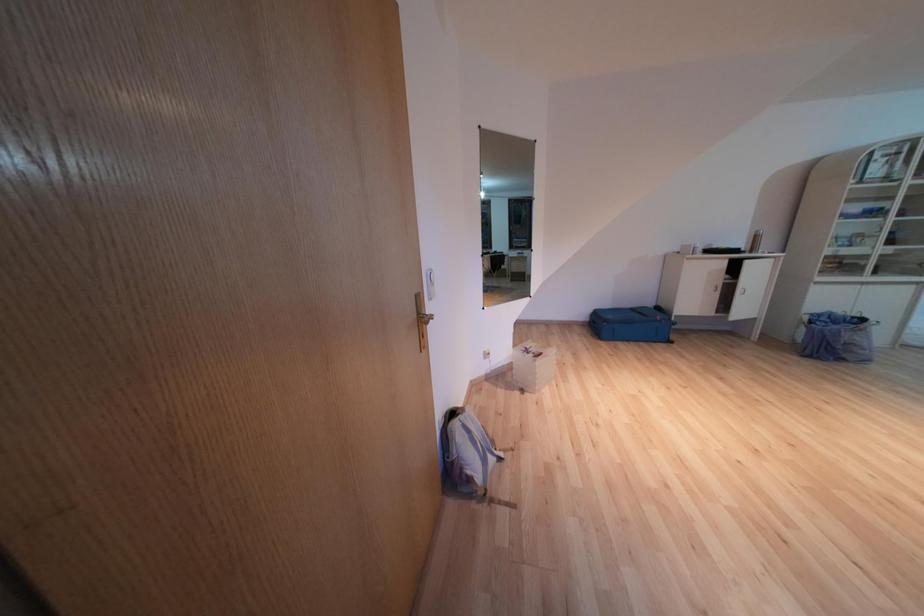
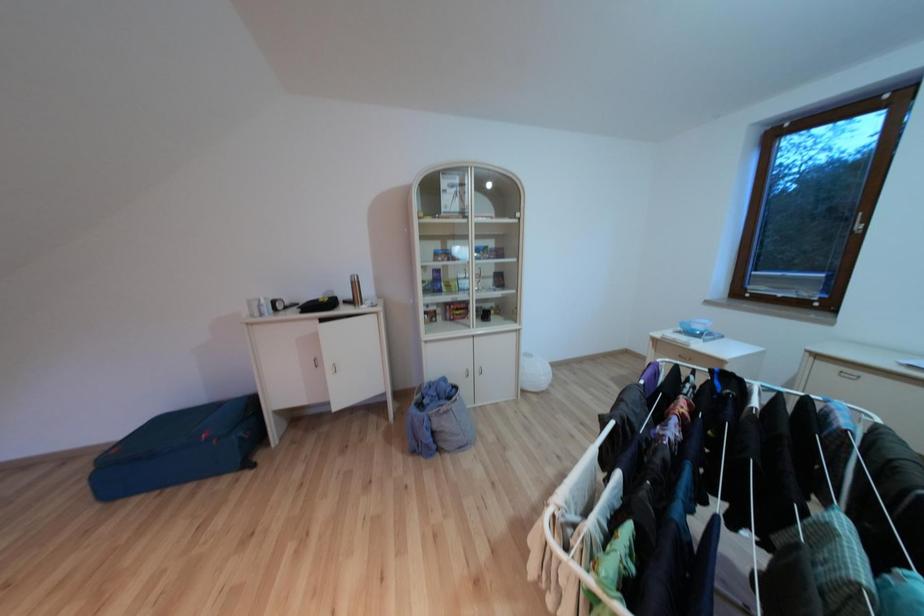
Question: The images are taken continuously from a first-person perspective. In which direction are you moving?

Choices:
 (A) Left
 (B) Right
 (C) Forward
 (D) Backward

Answer: (B)